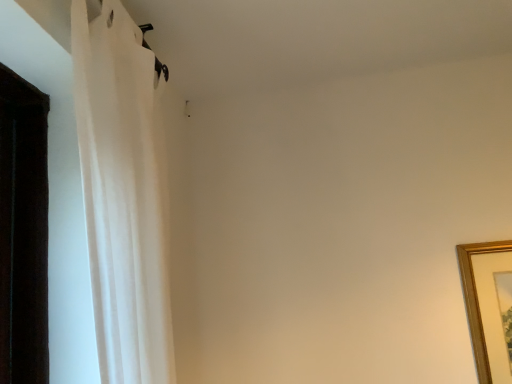
I want to click on white sheer curtain at left, so click(x=122, y=195).

Describe the element at coordinates (122, 195) in the screenshot. I see `white sheer curtain at left` at that location.

Locate an element on the screen. white sheer curtain at left is located at coordinates (122, 195).